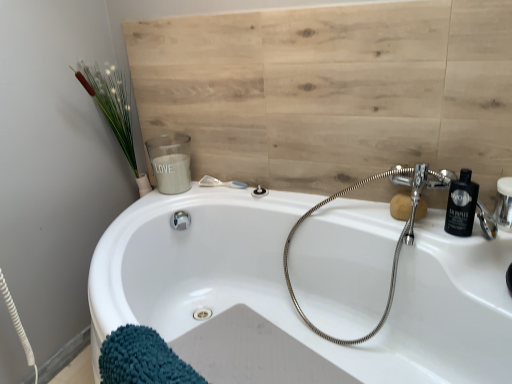
Question: Is matte silver shower at upper center, the second shower when ordered from left to right, at the right side of chrome flexible hose at upper right?

Choices:
 (A) yes
 (B) no

Answer: (B)

Question: From a real-world perspective, does matte silver shower at upper center, the second shower when ordered from left to right, stand above chrome flexible hose at upper right?

Choices:
 (A) no
 (B) yes

Answer: (B)

Question: Is matte silver shower at upper center, marked as the first shower in a right-to-left arrangement, further to camera compared to chrome flexible hose at upper right?

Choices:
 (A) yes
 (B) no

Answer: (A)

Question: Is matte silver shower at upper center, the second shower when ordered from left to right, looking in the opposite direction of chrome flexible hose at upper right?

Choices:
 (A) no
 (B) yes

Answer: (A)

Question: From the image's perspective, is matte silver shower at upper center, the second shower when ordered from left to right, under chrome flexible hose at upper right?

Choices:
 (A) yes
 (B) no

Answer: (B)

Question: From a real-world perspective, is white matte candle at upper left physically located above or below clear plastic shower at upper center, placed as the first shower when sorted from left to right?

Choices:
 (A) below
 (B) above

Answer: (B)

Question: Is white matte candle at upper left taller or shorter than clear plastic shower at upper center, placed as the first shower when sorted from left to right?

Choices:
 (A) short
 (B) tall

Answer: (B)

Question: Looking at their shapes, would you say white matte candle at upper left is wider or thinner than clear plastic shower at upper center, placed as the first shower when sorted from left to right?

Choices:
 (A) wide
 (B) thin

Answer: (A)

Question: Looking at the image, does white matte candle at upper left seem bigger or smaller compared to clear plastic shower at upper center, the second shower in the right-to-left sequence?

Choices:
 (A) small
 (B) big

Answer: (B)

Question: Is chrome flexible hose at upper right wider or thinner than white matte candle at upper left?

Choices:
 (A) wide
 (B) thin

Answer: (A)

Question: Is point (408, 243) positioned closer to the camera than point (188, 183)?

Choices:
 (A) farther
 (B) closer

Answer: (B)

Question: Would you say chrome flexible hose at upper right is inside or outside white matte candle at upper left?

Choices:
 (A) inside
 (B) outside

Answer: (B)

Question: Considering the positions of chrome flexible hose at upper right and white matte candle at upper left in the image, is chrome flexible hose at upper right bigger or smaller than white matte candle at upper left?

Choices:
 (A) small
 (B) big

Answer: (B)

Question: From a real-world perspective, is white glossy bathtub at center above or below chrome flexible hose at upper right?

Choices:
 (A) below
 (B) above

Answer: (A)

Question: In terms of width, does white glossy bathtub at center look wider or thinner when compared to chrome flexible hose at upper right?

Choices:
 (A) thin
 (B) wide

Answer: (B)